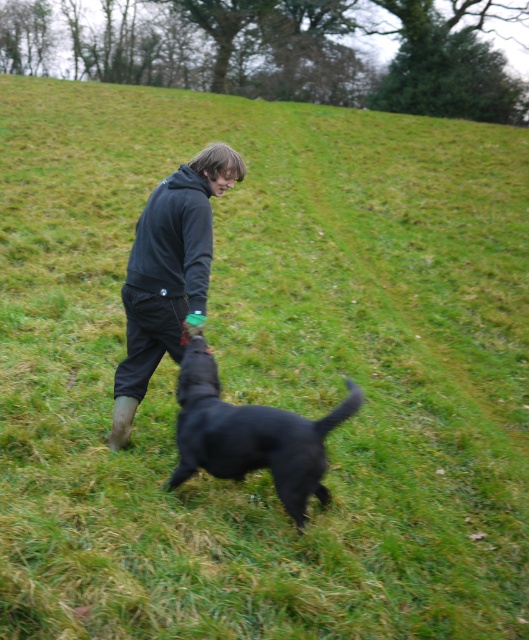
You are a photographer standing at the edge of the field. You want to take a photo of the dark gray hoodie at center and the black matte dog at center such that both are in focus. Given that your camera has a depth of field that can sharply capture objects within 25 inches of each other, will you need to adjust your focus to ensure both are clear?

The dark gray hoodie at center is 27.80 inches away from the black matte dog at center. Since the distance between them exceeds the camera s 25 inch depth of field range, you will need to adjust your focus to ensure both are in focus.